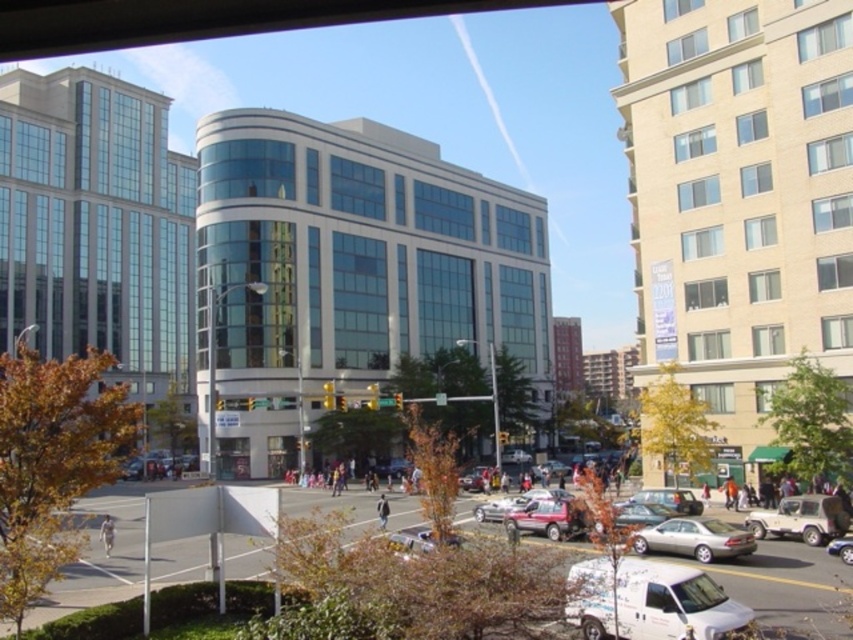
Question: Among these points, which one is nearest to the camera?

Choices:
 (A) 427,545
 (B) 663,582
 (C) 677,538

Answer: (B)

Question: Which object is the farthest from the white matte van at lower center?

Choices:
 (A) matte white suv at lower right
 (B) dark blue jeans at center
 (C) metallic blue sedan at lower right

Answer: (B)

Question: Considering the real-world distances, which object is farthest from the metallic silver car at center?

Choices:
 (A) silver metallic sedan at lower right
 (B) metallic silver sedan at lower right
 (C) matte white suv at lower right

Answer: (C)

Question: Can you confirm if matte white suv at lower right is wider than metallic silver sedan at lower right?

Choices:
 (A) yes
 (B) no

Answer: (B)

Question: Does silver metallic sedan at lower right appear on the right side of metallic blue sedan at lower right?

Choices:
 (A) yes
 (B) no

Answer: (B)

Question: Does silver metallic sedan at lower right come in front of metallic blue sedan at lower right?

Choices:
 (A) no
 (B) yes

Answer: (A)